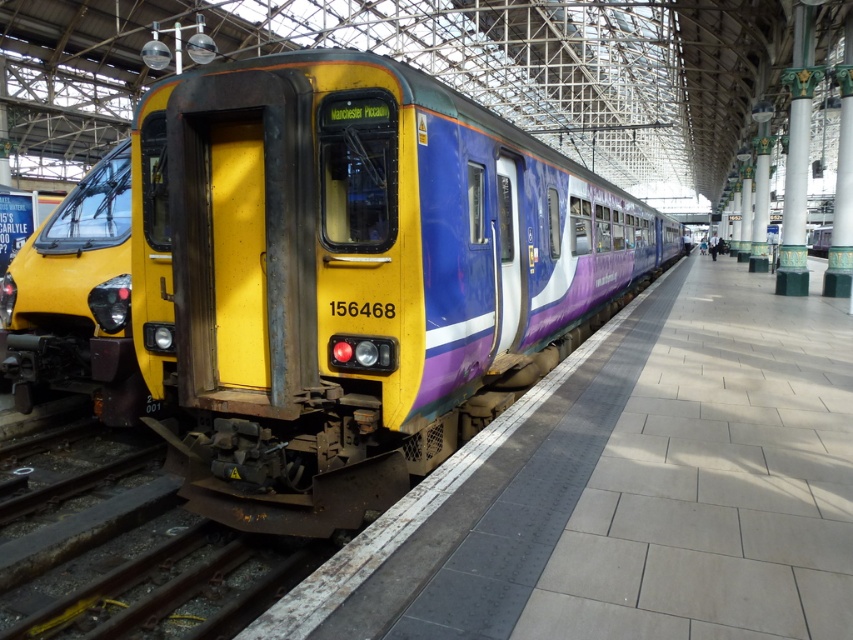
Which is below, metal at center or yellow matte train at left?

metal at center is below.

Is metal at center in front of yellow matte train at left?

Yes, metal at center is closer to the viewer.

Is point (265, 538) behind point (6, 349)?

No, (265, 538) is in front of (6, 349).

You are a GUI agent. You are given a task and a screenshot of the screen. Output one action in this format:
    pyautogui.click(x=<x>, y=<y>)
    Task: Click on the metal at center
    
    Given the screenshot: What is the action you would take?
    point(161,582)